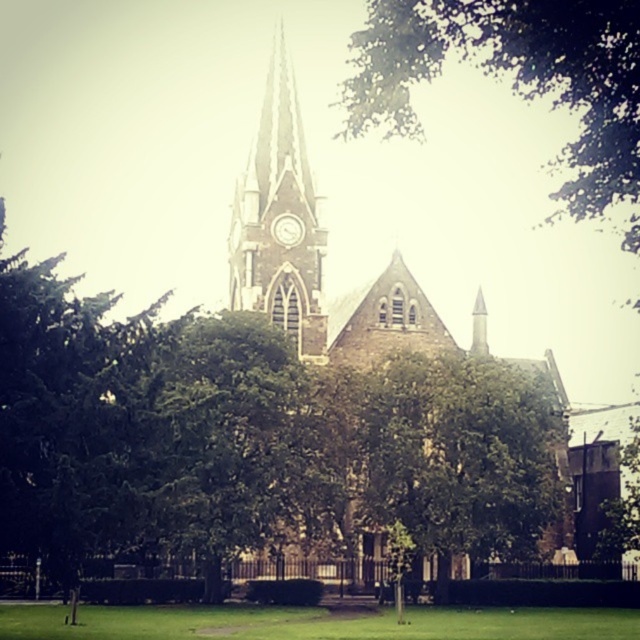
Is green leafy tree at center below dark brown stone clock tower at center?

Yes, green leafy tree at center is below dark brown stone clock tower at center.

Find the location of `green leafy tree at center`. green leafy tree at center is located at coordinates (460, 456).

Is brown stone church at center thinner than dark brown stone clock tower at center?

No, brown stone church at center is not thinner than dark brown stone clock tower at center.

Is brown stone church at center positioned in front of dark brown stone clock tower at center?

No, it is behind dark brown stone clock tower at center.

Is point (378, 358) farther from viewer compared to point (276, 102)?

No, it is not.

You are a GUI agent. You are given a task and a screenshot of the screen. Output one action in this format:
    pyautogui.click(x=<x>, y=<y>)
    Task: Click on the brown stone church at center
    The height and width of the screenshot is (640, 640).
    Given the screenshot: What is the action you would take?
    pyautogui.click(x=324, y=259)

Is dark brown stone clock tower at center in front of white glossy clock at center?

Yes, it is.

Find the location of `dark brown stone clock tower at center`. dark brown stone clock tower at center is located at coordinates (275, 216).

Locate an element on the screen. dark brown stone clock tower at center is located at coordinates (275, 216).